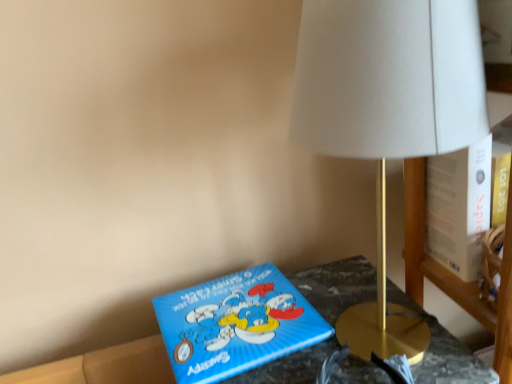
You are a GUI agent. You are given a task and a screenshot of the screen. Output one action in this format:
    pyautogui.click(x=<x>, y=<y>)
    Task: Click on the free spot above blue matte puzzle box at lower center (from a real-world perspective)
    The height and width of the screenshot is (384, 512).
    Given the screenshot: What is the action you would take?
    pyautogui.click(x=231, y=313)